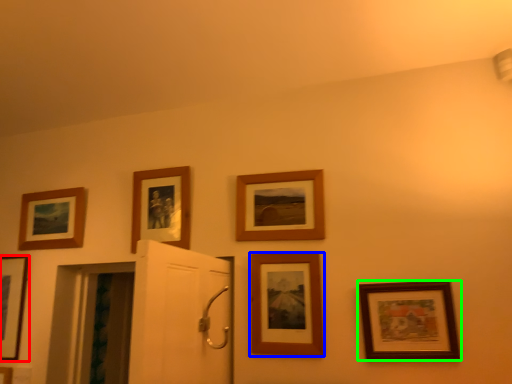
Question: Estimate the real-world distances between objects in this image. Which object is farther from picture frame (highlighted by a red box), picture frame (highlighted by a blue box) or picture frame (highlighted by a green box)?

Choices:
 (A) picture frame
 (B) picture frame

Answer: (B)